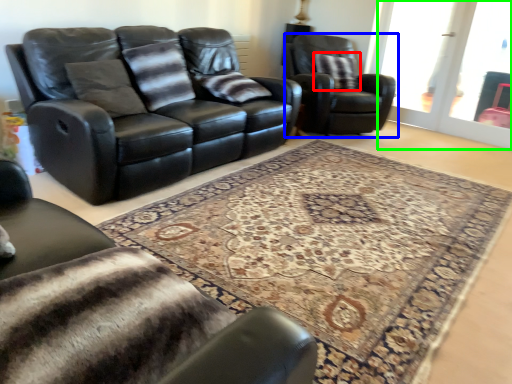
Question: Considering the real-world distances, which object is farthest from pillow (highlighted by a red box)? chair (highlighted by a blue box) or screen door (highlighted by a green box)?

Choices:
 (A) chair
 (B) screen door

Answer: (B)